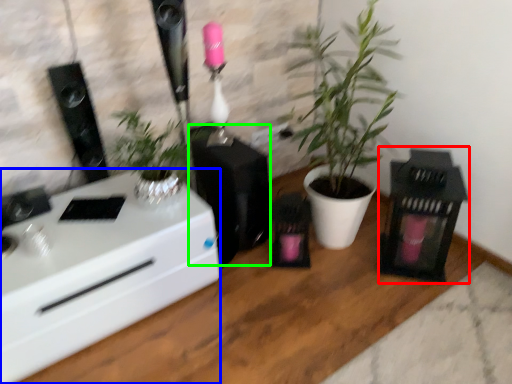
Question: Which is nearer to the appliance (highlighted by a red box)? desk (highlighted by a blue box) or appliance (highlighted by a green box).

Choices:
 (A) desk
 (B) appliance

Answer: (B)